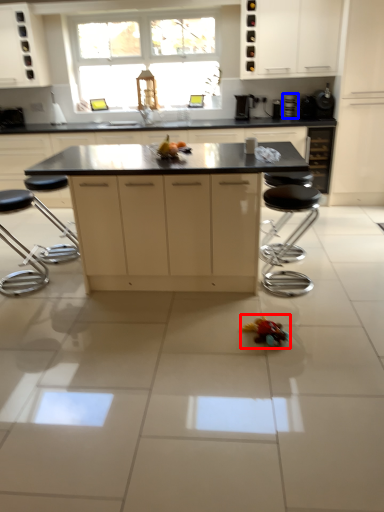
Question: Which object is closer to the camera taking this photo, toy (highlighted by a red box) or appliance (highlighted by a blue box)?

Choices:
 (A) toy
 (B) appliance

Answer: (A)